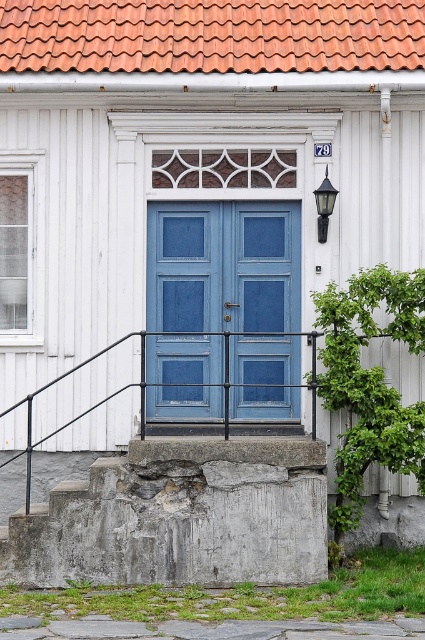
Find the location of `gray rough concrete at lower center`. gray rough concrete at lower center is located at coordinates click(x=180, y=516).

Is gray rough concrete at lower center above blue painted wood door at center?

Incorrect, gray rough concrete at lower center is not positioned above blue painted wood door at center.

Describe the element at coordinates (180, 516) in the screenshot. This screenshot has height=640, width=425. I see `gray rough concrete at lower center` at that location.

Identify the location of gray rough concrete at lower center. (180, 516).

Who is shorter, gray rough concrete at lower center or gray concrete at lower center?

Standing shorter between the two is gray concrete at lower center.

Is gray rough concrete at lower center shorter than gray concrete at lower center?

No, gray rough concrete at lower center is not shorter than gray concrete at lower center.

Between point (252, 449) and point (272, 632), which one is positioned in front?

Positioned in front is point (272, 632).

Locate an element on the screen. This screenshot has width=425, height=640. gray rough concrete at lower center is located at coordinates (180, 516).

Is the position of terracotta clay tiles at upper center less distant than that of black glass lamp at upper right?

Yes, it is.

Describe the element at coordinates (210, 35) in the screenshot. I see `terracotta clay tiles at upper center` at that location.

Is point (226, 17) positioned after point (319, 204)?

Yes, point (226, 17) is farther from viewer.

Locate an element on the screen. The height and width of the screenshot is (640, 425). terracotta clay tiles at upper center is located at coordinates (210, 35).